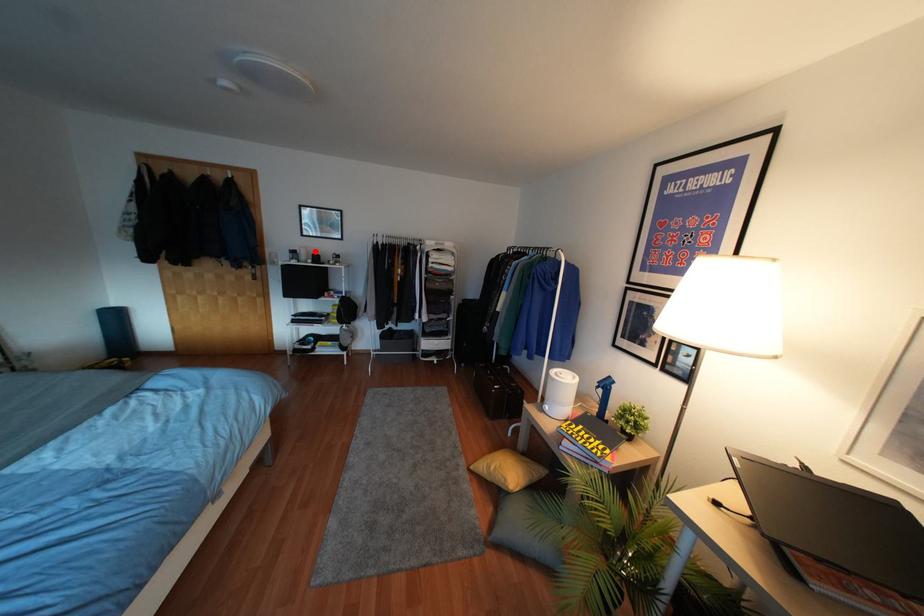
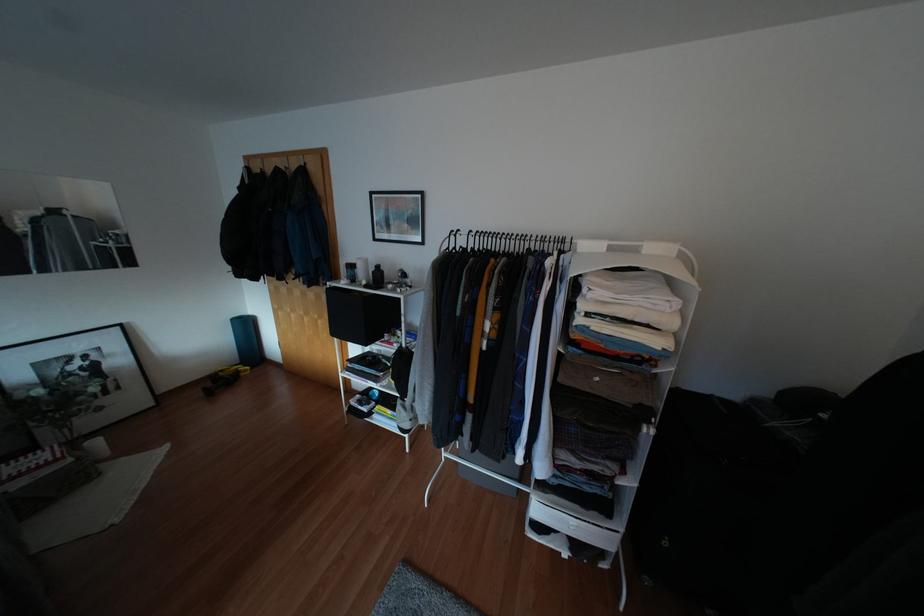
In the second image, find the point that corresponds to the highlighted location in the first image.

(377, 265)